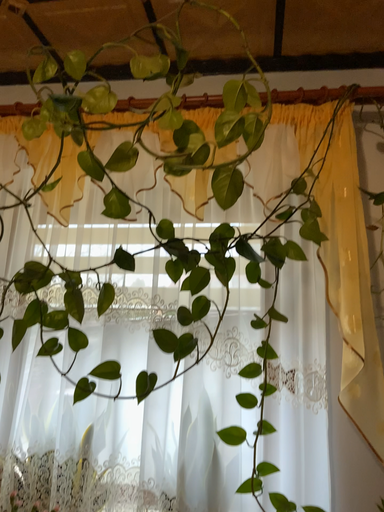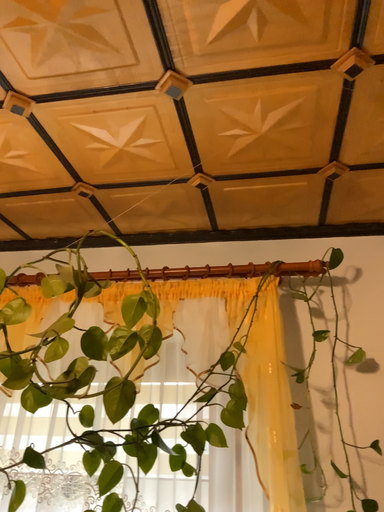
Question: How did the camera likely rotate when shooting the video?

Choices:
 (A) rotated downward
 (B) rotated upward

Answer: (B)